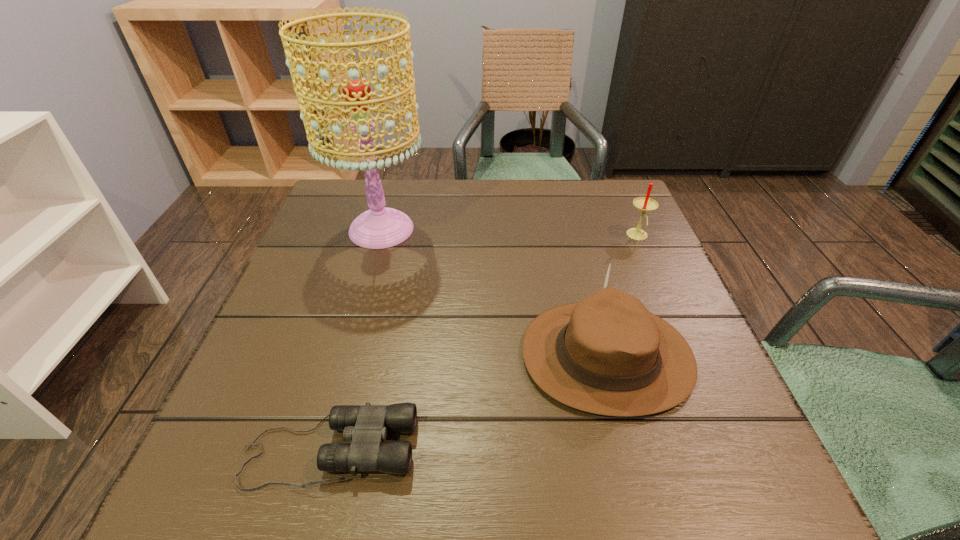
Image resolution: width=960 pixels, height=540 pixels. What are the coordinates of `lampshade that is at the far edge` in the screenshot? It's located at (380, 227).

The image size is (960, 540). Find the location of `candle that is at the far edge`. candle that is at the far edge is located at coordinates (646, 204).

This screenshot has height=540, width=960. Identify the location of object that is at the near edge. (366, 426).

The height and width of the screenshot is (540, 960). I want to click on lampshade situated at the left edge, so click(x=380, y=227).

You are a GUI agent. You are given a task and a screenshot of the screen. Output one action in this format:
    pyautogui.click(x=<x>, y=<y>)
    Task: Click on the binoculars at the left edge
    This screenshot has width=960, height=540.
    Given the screenshot: What is the action you would take?
    [366, 426]

Where is `candle present at the right edge`? candle present at the right edge is located at coordinates (646, 204).

I want to click on fedora situated at the right edge, so click(x=607, y=354).

This screenshot has height=540, width=960. In order to click on object at the far left corner in this screenshot , I will do `click(380, 227)`.

What are the coordinates of `object that is at the near left corner` in the screenshot? It's located at (366, 426).

Where is `object that is positioned at the far right corner`? This screenshot has height=540, width=960. object that is positioned at the far right corner is located at coordinates (646, 204).